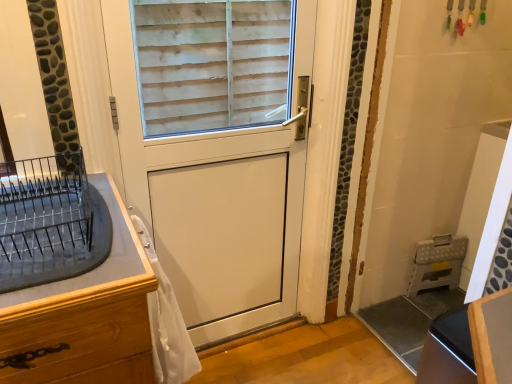
What is the approximate width of white sheer fabric at lower left?

white sheer fabric at lower left is 5.71 inches wide.

The width and height of the screenshot is (512, 384). I want to click on white sheer fabric at lower left, so click(167, 323).

Find the location of a particular element. This screenshot has width=512, height=384. white plastic folding stool at lower right, the first appliance when ordered from back to front is located at coordinates (437, 263).

Describe the element at coordinates (470, 344) in the screenshot. I see `black glossy vanity at lower right` at that location.

Image resolution: width=512 pixels, height=384 pixels. What do you see at coordinates (50, 222) in the screenshot?
I see `black metal dish rack at left, the first appliance from the top` at bounding box center [50, 222].

Locate an element on the screen. white sheer fabric at lower left is located at coordinates (167, 323).

Looking at this image, between white plastic folding stool at lower right, the second appliance from the front, and white matte door at center, which one has larger width?

With larger width is white matte door at center.

Consider the image. Relative to white matte door at center, is white plastic folding stool at lower right, which is the first appliance in right-to-left order, in front or behind?

Visually, white plastic folding stool at lower right, which is the first appliance in right-to-left order, is located behind white matte door at center.

Looking at this image, considering the sizes of white plastic folding stool at lower right, the 2th appliance from the top, and white matte door at center in the image, is white plastic folding stool at lower right, the 2th appliance from the top, taller or shorter than white matte door at center?

Considering their sizes, white plastic folding stool at lower right, the 2th appliance from the top, has less height than white matte door at center.

Is white plastic folding stool at lower right, the 2th appliance from the top, not near white matte door at center?

Actually, white plastic folding stool at lower right, the 2th appliance from the top, and white matte door at center are a little close together.

Between black metal dish rack at left, which appears as the second appliance when viewed from the right, and white sheer fabric at lower left, which one appears on the left side from the viewer's perspective?

black metal dish rack at left, which appears as the second appliance when viewed from the right, is more to the left.

Is point (100, 254) closer to camera compared to point (160, 283)?

Yes.

You are a GUI agent. You are given a task and a screenshot of the screen. Output one action in this format:
    pyautogui.click(x=<x>, y=<y>)
    Task: Click on the appliance in front of the white sheer fabric at lower left
    The height and width of the screenshot is (384, 512).
    Given the screenshot: What is the action you would take?
    pyautogui.click(x=50, y=222)

Measure the distance between black metal dish rack at left, the first appliance from the top, and white sheer fabric at lower left.

They are 28.19 centimeters apart.

Is black glossy vanity at lower right aimed at white plastic folding stool at lower right, marked as the first appliance in a bottom-to-top arrangement?

No, black glossy vanity at lower right is not turned towards white plastic folding stool at lower right, marked as the first appliance in a bottom-to-top arrangement.

Considering the relative sizes of black glossy vanity at lower right and white plastic folding stool at lower right, the first appliance when ordered from back to front, in the image provided, is black glossy vanity at lower right shorter than white plastic folding stool at lower right, the first appliance when ordered from back to front,?

No.

Consider the image. From a real-world perspective, between black glossy vanity at lower right and white plastic folding stool at lower right, the first appliance when ordered from back to front, who is vertically higher?

In real-world perspective, black glossy vanity at lower right is above.

From the picture: From the image's perspective, is white sheer fabric at lower left located above or below white matte door at center?

white sheer fabric at lower left is below white matte door at center.

Visually, is white sheer fabric at lower left positioned to the left or to the right of white matte door at center?

In the image, white sheer fabric at lower left appears on the left side of white matte door at center.

Consider the image. Considering the sizes of objects white sheer fabric at lower left and white matte door at center in the image provided, who is wider, white sheer fabric at lower left or white matte door at center?

Wider between the two is white sheer fabric at lower left.

Is white sheer fabric at lower left in front of or behind white matte door at center in the image?

white sheer fabric at lower left is positioned closer to the viewer than white matte door at center.

Is black glossy vanity at lower right oriented away from white sheer fabric at lower left?

No.

From the picture: Is black glossy vanity at lower right directly adjacent to white sheer fabric at lower left?

No, black glossy vanity at lower right is not in contact with white sheer fabric at lower left.

Is black glossy vanity at lower right positioned beyond the bounds of white sheer fabric at lower left?

Yes, black glossy vanity at lower right is located beyond the bounds of white sheer fabric at lower left.

Is white sheer fabric at lower left not near white plastic folding stool at lower right, marked as the first appliance in a bottom-to-top arrangement?

Yes.

Considering the sizes of objects white sheer fabric at lower left and white plastic folding stool at lower right, marked as the first appliance in a bottom-to-top arrangement, in the image provided, who is shorter, white sheer fabric at lower left or white plastic folding stool at lower right, marked as the first appliance in a bottom-to-top arrangement,?

white plastic folding stool at lower right, marked as the first appliance in a bottom-to-top arrangement.

Is white sheer fabric at lower left aimed at white plastic folding stool at lower right, the second appliance from the front?

No, white sheer fabric at lower left is not oriented towards white plastic folding stool at lower right, the second appliance from the front.

From the image's perspective, would you say white sheer fabric at lower left is shown under white plastic folding stool at lower right, marked as the first appliance in a bottom-to-top arrangement?

No, from the image's perspective, white sheer fabric at lower left is not beneath white plastic folding stool at lower right, marked as the first appliance in a bottom-to-top arrangement.

From the picture: Considering the relative sizes of black metal dish rack at left, marked as the 1th appliance in a left-to-right arrangement, and black glossy vanity at lower right in the image provided, is black metal dish rack at left, marked as the 1th appliance in a left-to-right arrangement, wider than black glossy vanity at lower right?

Yes.

Visually, is black metal dish rack at left, the first appliance from the top, positioned to the left or to the right of black glossy vanity at lower right?

black metal dish rack at left, the first appliance from the top, is positioned on black glossy vanity at lower right's left side.

Is black metal dish rack at left, which is counted as the 2th appliance, starting from the back, oriented away from black glossy vanity at lower right?

black metal dish rack at left, which is counted as the 2th appliance, starting from the back, is not turned away from black glossy vanity at lower right.

Which is more distant, (80, 216) or (505, 330)?

The point (80, 216) is farther from the camera.

At what (x,y) coordinates should I click in order to perform the action: click on appliance below the white matte door at center (from the image's perspective). Please return your answer as a coordinate pair (x, y). Looking at the image, I should click on (437, 263).

You are a GUI agent. You are given a task and a screenshot of the screen. Output one action in this format:
    pyautogui.click(x=<x>, y=<y>)
    Task: Click on the material that is on the right side of black metal dish rack at left, which appears as the second appliance when viewed from the right
    This screenshot has height=384, width=512.
    Given the screenshot: What is the action you would take?
    pyautogui.click(x=167, y=323)

Which object lies nearer to the anchor point white sheer fabric at lower left, black metal dish rack at left, which is counted as the 2th appliance, starting from the back, or white plastic folding stool at lower right, marked as the first appliance in a bottom-to-top arrangement?

black metal dish rack at left, which is counted as the 2th appliance, starting from the back, is positioned closer to the anchor white sheer fabric at lower left.

Looking at the image, which one is located closer to white matte door at center, white sheer fabric at lower left or white plastic folding stool at lower right, which ranks as the 2th appliance in left-to-right order?

white sheer fabric at lower left.

Estimate the real-world distances between objects in this image. Which object is further from white matte door at center, black metal dish rack at left, which appears as the second appliance when ordered from the bottom, or white plastic folding stool at lower right, which ranks as the 2th appliance in left-to-right order?

white plastic folding stool at lower right, which ranks as the 2th appliance in left-to-right order, lies further to white matte door at center than the other object.

Looking at the image, which one is located further to black glossy vanity at lower right, black metal dish rack at left, which appears as the second appliance when viewed from the right, or white sheer fabric at lower left?

Based on the image, black metal dish rack at left, which appears as the second appliance when viewed from the right, appears to be further to black glossy vanity at lower right.

Based on their spatial positions, is black glossy vanity at lower right or white matte door at center further from black metal dish rack at left, which is counted as the 2th appliance, starting from the back?

black glossy vanity at lower right lies further to black metal dish rack at left, which is counted as the 2th appliance, starting from the back, than the other object.

Looking at the image, which one is located further to black glossy vanity at lower right, white sheer fabric at lower left or white matte door at center?

The object further to black glossy vanity at lower right is white matte door at center.

When comparing their distances from white sheer fabric at lower left, does white plastic folding stool at lower right, the first appliance when ordered from back to front, or white matte door at center seem closer?

white matte door at center lies closer to white sheer fabric at lower left than the other object.

Based on their spatial positions, is white sheer fabric at lower left or white plastic folding stool at lower right, which is the first appliance in right-to-left order, closer to black glossy vanity at lower right?

white sheer fabric at lower left lies closer to black glossy vanity at lower right than the other object.

The height and width of the screenshot is (384, 512). What are the coordinates of `material located between black metal dish rack at left, which appears as the second appliance when viewed from the right, and black glossy vanity at lower right in the left-right direction` in the screenshot? It's located at (167, 323).

The image size is (512, 384). I want to click on door located between black glossy vanity at lower right and white plastic folding stool at lower right, which is the first appliance in right-to-left order, in the depth direction, so click(x=212, y=191).

Image resolution: width=512 pixels, height=384 pixels. In order to click on vanity between white sheer fabric at lower left and white plastic folding stool at lower right, which is the first appliance in right-to-left order, from front to back in this screenshot , I will do `click(470, 344)`.

This screenshot has width=512, height=384. What are the coordinates of `door situated between white sheer fabric at lower left and black glossy vanity at lower right from left to right` in the screenshot? It's located at (212, 191).